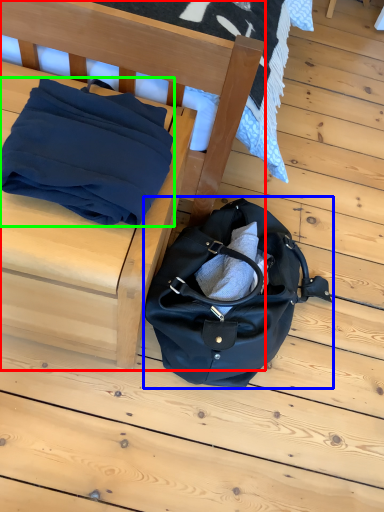
Question: Estimate the real-world distances between objects in this image. Which object is farther from furniture (highlighted by a red box), handbag (highlighted by a blue box) or blanket (highlighted by a green box)?

Choices:
 (A) handbag
 (B) blanket

Answer: (A)